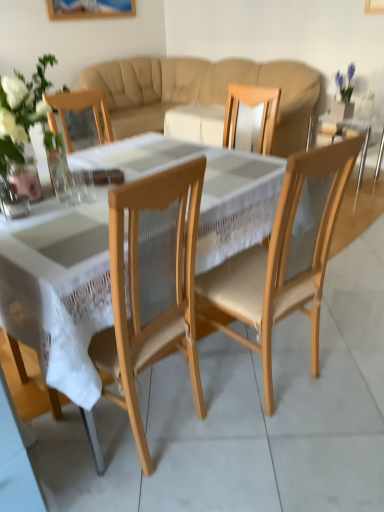
The image size is (384, 512). Describe the element at coordinates (25, 174) in the screenshot. I see `clear glass vase at left` at that location.

The width and height of the screenshot is (384, 512). I want to click on clear glass vase at left, so click(x=25, y=174).

What do you see at coordinates (85, 186) in the screenshot? The width and height of the screenshot is (384, 512). I see `transparent glass at center, which is counted as the first tableware, starting from the right` at bounding box center [85, 186].

What do you see at coordinates (21, 111) in the screenshot? I see `translucent glass vase at left` at bounding box center [21, 111].

The image size is (384, 512). Find the location of `clear glass vase at left`. clear glass vase at left is located at coordinates (25, 174).

Relative to wooden side table at right, is translucent glass vase at left in front or behind?

Visually, translucent glass vase at left is located in front of wooden side table at right.

Is translucent glass vase at left located outside wooden side table at right?

Yes.

Is translucent glass vase at left to the right of wooden side table at right from the viewer's perspective?

In fact, translucent glass vase at left is to the left of wooden side table at right.

Considering the relative sizes of translucent glass vase at left and wooden side table at right in the image provided, is translucent glass vase at left shorter than wooden side table at right?

Yes.

How different are the orientations of natural wood chair at center and clear glass at center, which is the 1th tableware from left to right, in degrees?

174 degrees separate the facing orientations of natural wood chair at center and clear glass at center, which is the 1th tableware from left to right.

From the picture: Is natural wood chair at center facing towards clear glass at center, which is the 1th tableware from left to right?

No, natural wood chair at center is not facing towards clear glass at center, which is the 1th tableware from left to right.

From the image's perspective, between natural wood chair at center and clear glass at center, which is the 1th tableware from left to right, which one is located above?

clear glass at center, which is the 1th tableware from left to right, is shown above in the image.

Which object is positioned more to the right, natural wood chair at center or clear glass at center, the second tableware in the right-to-left sequence?

natural wood chair at center.

What are the coordinates of `the 2nd tableware to the right of the translucent glass vase at left, starting your count from the anchor` in the screenshot? It's located at (85, 186).

Is transparent glass at center, the 2th tableware in the left-to-right sequence, facing away from translucent glass vase at left?

Absolutely, transparent glass at center, the 2th tableware in the left-to-right sequence, is directed away from translucent glass vase at left.

How distant is transparent glass at center, the 2th tableware in the left-to-right sequence, from translucent glass vase at left?

They are 2.41 meters apart.

From a real-world perspective, is transparent glass at center, which is counted as the first tableware, starting from the right, positioned over translucent glass vase at left based on gravity?

No, from a real-world perspective, transparent glass at center, which is counted as the first tableware, starting from the right, is not on top of translucent glass vase at left.

Could you tell me if white lace tablecloth at center is turned towards wooden side table at right?

Yes, white lace tablecloth at center faces towards wooden side table at right.

From the image's perspective, which object appears higher, white lace tablecloth at center or wooden side table at right?

From the image's view, wooden side table at right is above.

Considering the sizes of white lace tablecloth at center and wooden side table at right in the image, is white lace tablecloth at center taller or shorter than wooden side table at right?

Considering their sizes, white lace tablecloth at center has more height than wooden side table at right.

Would you say white lace tablecloth at center is to the left or to the right of wooden side table at right in the picture?

From the image, it's evident that white lace tablecloth at center is to the left of wooden side table at right.

Does translucent glass vase at left have a lesser height compared to transparent glass at center, the 2th tableware in the left-to-right sequence?

Incorrect, the height of translucent glass vase at left does not fall short of that of transparent glass at center, the 2th tableware in the left-to-right sequence.

Based on the photo, is translucent glass vase at left turned away from transparent glass at center, the 2th tableware in the left-to-right sequence?

translucent glass vase at left is not turned away from transparent glass at center, the 2th tableware in the left-to-right sequence.

From the image's perspective, is translucent glass vase at left on transparent glass at center, the 2th tableware in the left-to-right sequence?

Yes, from the image's perspective, translucent glass vase at left is on top of transparent glass at center, the 2th tableware in the left-to-right sequence.

From a real-world perspective, who is located lower, translucent glass vase at left or transparent glass at center, which is counted as the first tableware, starting from the right?

In real-world perspective, transparent glass at center, which is counted as the first tableware, starting from the right, is lower.

Is wooden side table at right far from clear glass at center, the second tableware in the right-to-left sequence?

Yes, wooden side table at right is far from clear glass at center, the second tableware in the right-to-left sequence.

Based on the photo, considering the relative sizes of wooden side table at right and clear glass at center, which is the 1th tableware from left to right, in the image provided, is wooden side table at right shorter than clear glass at center, which is the 1th tableware from left to right,?

In fact, wooden side table at right may be taller than clear glass at center, which is the 1th tableware from left to right.

From the picture: Is wooden side table at right closer to camera compared to clear glass at center, which is the 1th tableware from left to right?

That is False.

Would you say transparent glass at center, which is counted as the first tableware, starting from the right, is to the left or to the right of beige fabric couch at center in the picture?

transparent glass at center, which is counted as the first tableware, starting from the right, is positioned on beige fabric couch at center's left side.

Does transparent glass at center, the 2th tableware in the left-to-right sequence, touch beige fabric couch at center?

transparent glass at center, the 2th tableware in the left-to-right sequence, and beige fabric couch at center are not in contact.

How many degrees apart are the facing directions of transparent glass at center, which is counted as the first tableware, starting from the right, and beige fabric couch at center?

transparent glass at center, which is counted as the first tableware, starting from the right, and beige fabric couch at center are facing 77.9 degrees away from each other.

From the image's perspective, between transparent glass at center, the 2th tableware in the left-to-right sequence, and beige fabric couch at center, which one is located above?

beige fabric couch at center is shown above in the image.

Locate an element on the screen. side table below the translucent glass vase at left (from a real-world perspective) is located at coordinates (347, 134).

Locate an element on the screen. This screenshot has width=384, height=512. tableware that is the 2nd object to the left of the natural wood chair at center, starting at the anchor is located at coordinates 73,187.

In the scene shown: Considering their positions, is wooden side table at right positioned closer to beige fabric couch at center than clear glass vase at left?

Among the two, wooden side table at right is located nearer to beige fabric couch at center.

In the scene shown: Looking at the image, which one is located closer to white lace tablecloth at center, translucent glass vase at left or clear glass at center, which is the 1th tableware from left to right?

clear glass at center, which is the 1th tableware from left to right, is closer to white lace tablecloth at center.

From the picture: Based on their spatial positions, is wooden side table at right or white lace tablecloth at center closer to beige fabric couch at center?

wooden side table at right is positioned closer to the anchor beige fabric couch at center.

Considering their positions, is white lace tablecloth at center positioned closer to beige fabric couch at center than translucent glass vase at left?

The object closer to beige fabric couch at center is translucent glass vase at left.

Estimate the real-world distances between objects in this image. Which object is further from clear glass at center, which is the 1th tableware from left to right, clear glass vase at left or natural wood chair at center?

natural wood chair at center lies further to clear glass at center, which is the 1th tableware from left to right, than the other object.

When comparing their distances from transparent glass at center, the 2th tableware in the left-to-right sequence, does wooden side table at right or clear glass at center, which is the 1th tableware from left to right, seem closer?

The object closer to transparent glass at center, the 2th tableware in the left-to-right sequence, is clear glass at center, which is the 1th tableware from left to right.

Considering their positions, is clear glass at center, the second tableware in the right-to-left sequence, positioned closer to translucent glass vase at left than beige fabric couch at center?

beige fabric couch at center is positioned closer to the anchor translucent glass vase at left.

Estimate the real-world distances between objects in this image. Which object is closer to transparent glass at center, the 2th tableware in the left-to-right sequence, natural wood chair at center or translucent glass vase at left?

natural wood chair at center lies closer to transparent glass at center, the 2th tableware in the left-to-right sequence, than the other object.

I want to click on tableware located between white lace tablecloth at center and clear glass vase at left in the depth direction, so click(73, 187).

Where is `tableware positioned between clear glass at center, the second tableware in the right-to-left sequence, and wooden side table at right from near to far`? Image resolution: width=384 pixels, height=512 pixels. tableware positioned between clear glass at center, the second tableware in the right-to-left sequence, and wooden side table at right from near to far is located at coordinates (85, 186).

Locate an element on the screen. The height and width of the screenshot is (512, 384). tableware between translucent glass vase at left and transparent glass at center, the 2th tableware in the left-to-right sequence is located at coordinates (73, 187).

Where is `coffee table situated between translucent glass vase at left and natural wood chair at center from left to right`? The width and height of the screenshot is (384, 512). coffee table situated between translucent glass vase at left and natural wood chair at center from left to right is located at coordinates (59, 289).